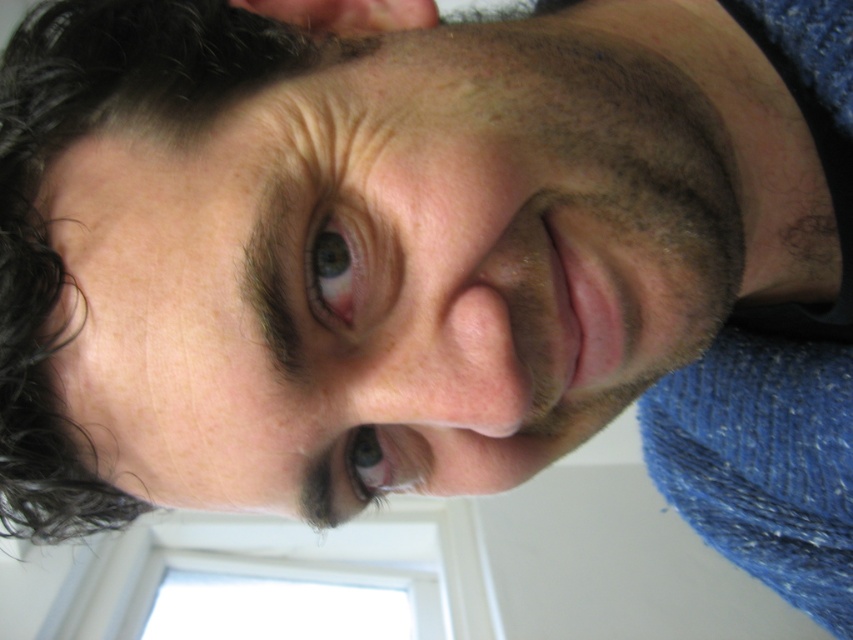
You are taking a photo of a person and notice two points on their face at coordinates point (x=45, y=269) and point (x=384, y=465). Based on the image, which point is closer to the camera?

Point (x=45, y=269) is closer to the camera than point (x=384, y=465).

You are a photographer adjusting the lighting in a studio. You need to ensure that the dark curly hair at upper left and the brown matte eye at center are both well lit. Based on their positions, which object should you adjust the light towards first?

The dark curly hair at upper left is to the left of the brown matte eye at center, so you should adjust the light towards the dark curly hair at upper left first to ensure both areas are properly illuminated.

What is the exact coordinate of the dark curly hair at upper left?

The dark curly hair at upper left is located at point [45,221].